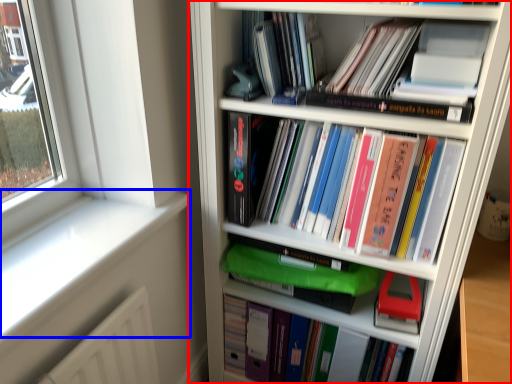
Question: Which object appears closest to the camera in this image, bookcase (highlighted by a red box) or window sill (highlighted by a blue box)?

Choices:
 (A) bookcase
 (B) window sill

Answer: (A)